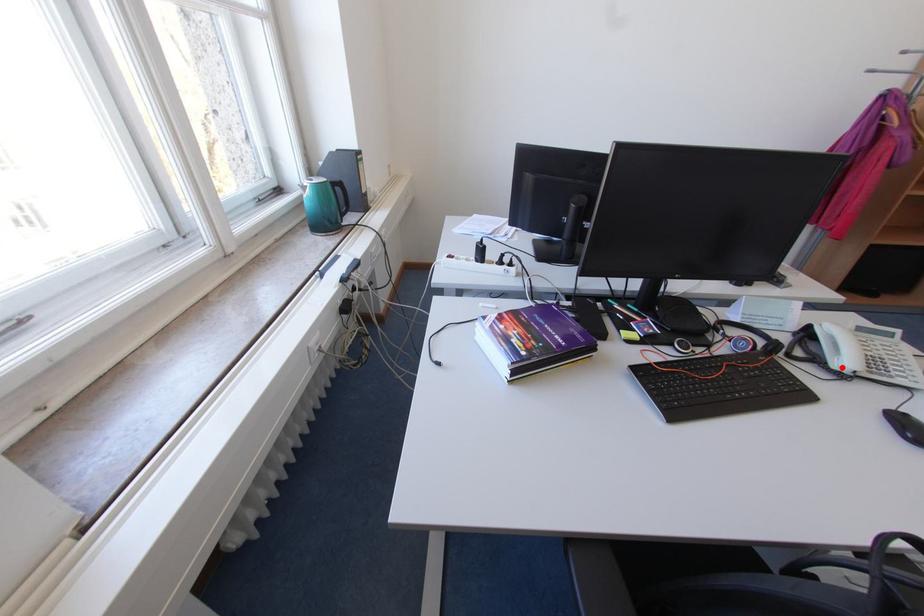
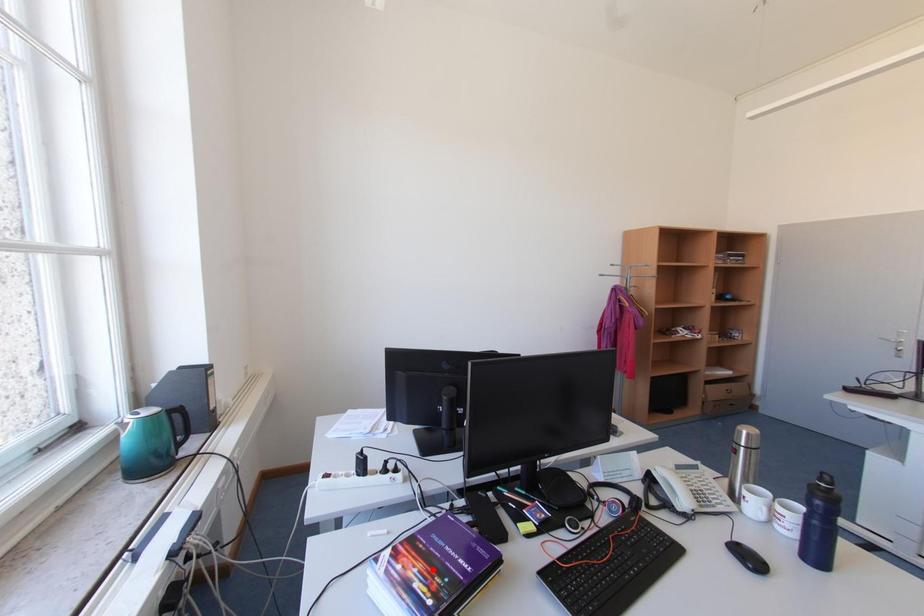
I am providing you with two images of the same scene from different viewpoints. A red point is marked on the first image and another point is marked on the second image. Are the points marked in image1 and image2 representing the same 3D position?

No